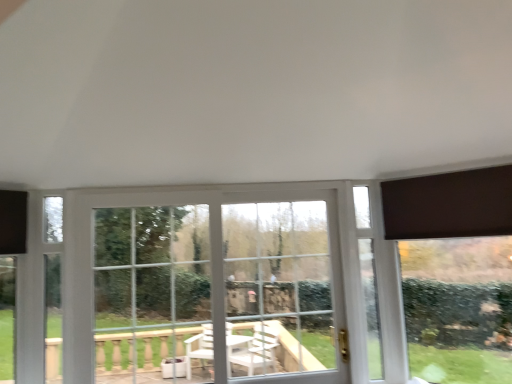
Question: Is clear glass bay window at center behind dark brown fabric at upper right?

Choices:
 (A) yes
 (B) no

Answer: (A)

Question: Does clear glass bay window at center have a larger size compared to dark brown fabric at upper right?

Choices:
 (A) yes
 (B) no

Answer: (A)

Question: From the image's perspective, is clear glass bay window at center located beneath dark brown fabric at upper right?

Choices:
 (A) no
 (B) yes

Answer: (B)

Question: From a real-world perspective, is clear glass bay window at center under dark brown fabric at upper right?

Choices:
 (A) no
 (B) yes

Answer: (B)

Question: From a real-world perspective, is clear glass bay window at center on dark brown fabric at upper right?

Choices:
 (A) yes
 (B) no

Answer: (B)

Question: From a real-world perspective, is clear glass bay window at center above or below dark brown fabric at upper right?

Choices:
 (A) below
 (B) above

Answer: (A)

Question: In terms of height, does clear glass bay window at center look taller or shorter compared to dark brown fabric at upper right?

Choices:
 (A) short
 (B) tall

Answer: (B)

Question: Which is correct: clear glass bay window at center is inside dark brown fabric at upper right, or outside of it?

Choices:
 (A) outside
 (B) inside

Answer: (A)

Question: Is clear glass bay window at center wider or thinner than dark brown fabric at upper right?

Choices:
 (A) wide
 (B) thin

Answer: (A)

Question: Is dark brown fabric at upper right inside the boundaries of white plastic window at center, or outside?

Choices:
 (A) outside
 (B) inside

Answer: (A)

Question: Based on their sizes in the image, would you say dark brown fabric at upper right is bigger or smaller than white plastic window at center?

Choices:
 (A) big
 (B) small

Answer: (B)

Question: Is dark brown fabric at upper right taller or shorter than white plastic window at center?

Choices:
 (A) tall
 (B) short

Answer: (B)

Question: From a real-world perspective, is dark brown fabric at upper right physically located above or below white plastic window at center?

Choices:
 (A) above
 (B) below

Answer: (A)

Question: Considering the positions of dark brown fabric at upper right and clear glass bay window at center in the image, is dark brown fabric at upper right taller or shorter than clear glass bay window at center?

Choices:
 (A) tall
 (B) short

Answer: (B)

Question: Do you think dark brown fabric at upper right is within clear glass bay window at center, or outside of it?

Choices:
 (A) inside
 (B) outside

Answer: (B)